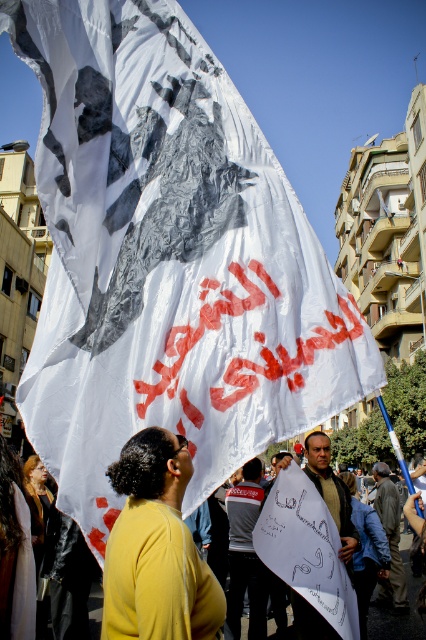
Question: Can you confirm if dark brown leather jacket at center is bigger than dark gray fabric at center?

Choices:
 (A) yes
 (B) no

Answer: (B)

Question: Among these objects, which one is farthest from the camera?

Choices:
 (A) dark brown leather jacket at center
 (B) dark gray fabric at center
 (C) dark gray sweater at center
 (D) yellow matte shirt at center

Answer: (B)

Question: Which object appears farthest from the camera in this image?

Choices:
 (A) dark gray sweater at center
 (B) dark brown leather jacket at center
 (C) dark gray fabric at center

Answer: (C)

Question: Does yellow matte shirt at center appear under dark gray fabric at center?

Choices:
 (A) no
 (B) yes

Answer: (A)

Question: Is dark gray sweater at center above dark brown leather jacket at center?

Choices:
 (A) no
 (B) yes

Answer: (A)

Question: Which of the following is the farthest from the observer?

Choices:
 (A) dark gray sweater at center
 (B) yellow matte shirt at center
 (C) dark gray fabric at center
 (D) dark brown leather jacket at center

Answer: (C)